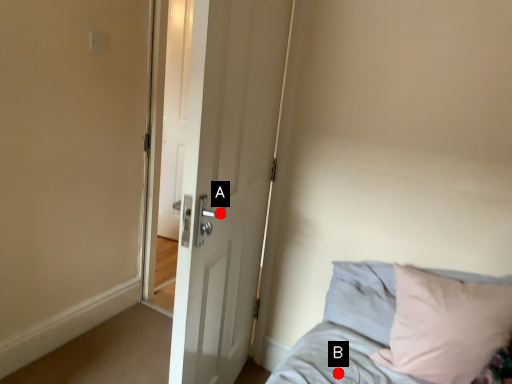
Question: Two points are circled on the image, labeled by A and B beside each circle. Which of the following is the closest to the observer?

Choices:
 (A) A is closer
 (B) B is closer

Answer: (B)